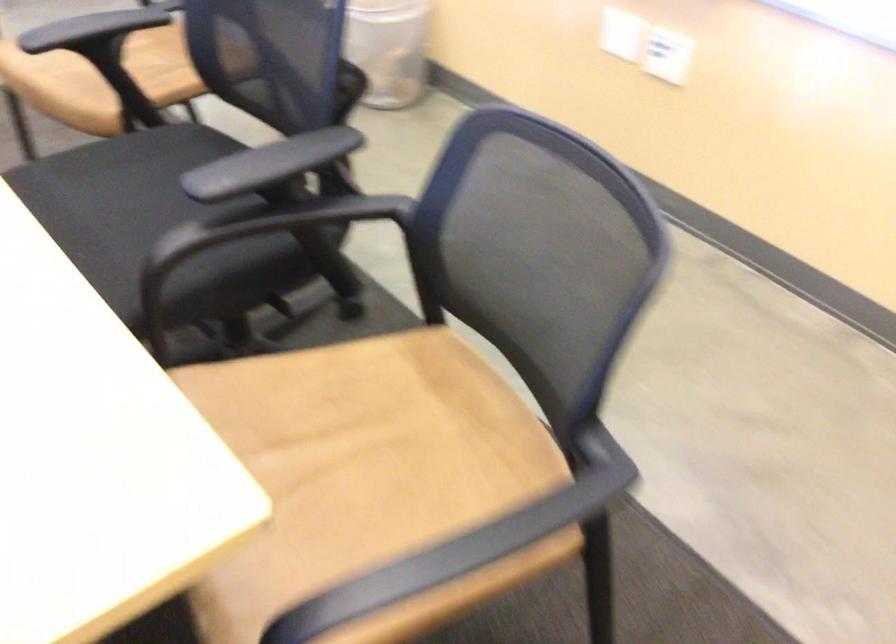
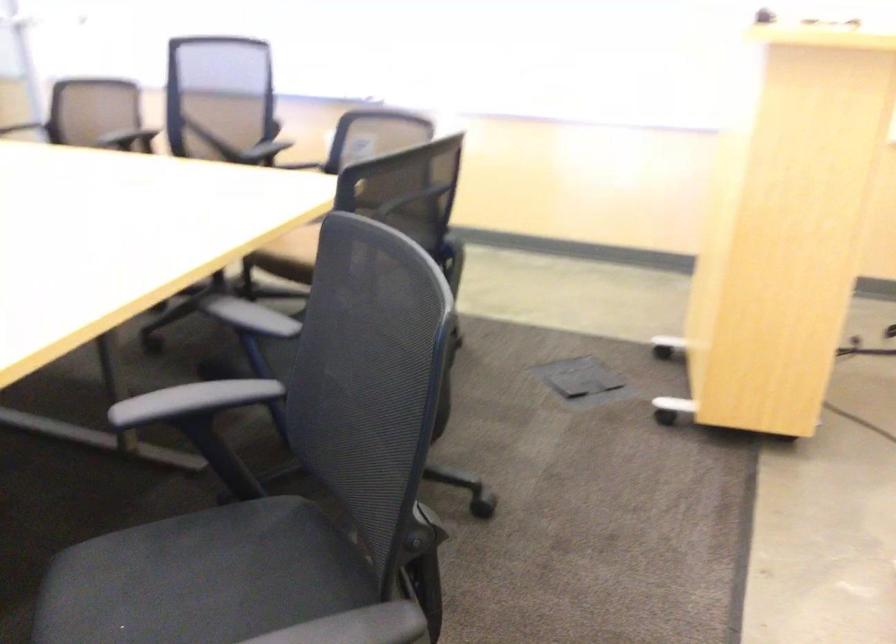
Question: I am providing you with two images of the same scene from different viewpoints. Which of the following objects are not visible in image2?

Choices:
 (A) brown chair sitting surface
 (B) black chair armrest
 (C) black chair sitting surface
 (D) sink stopper rod

Answer: (C)